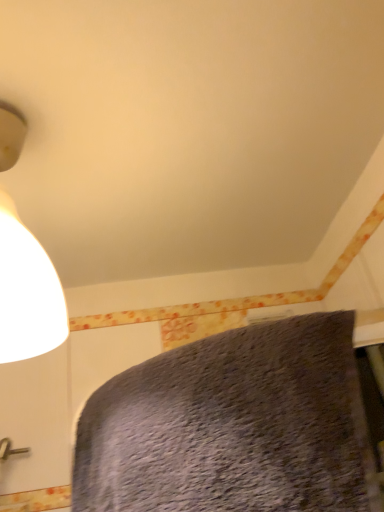
Question: Looking at their shapes, would you say matte white lampshade at upper left is wider or thinner than textured gray bed at lower center?

Choices:
 (A) wide
 (B) thin

Answer: (A)

Question: Is matte white lampshade at upper left to the left or to the right of textured gray bed at lower center in the image?

Choices:
 (A) left
 (B) right

Answer: (A)

Question: In terms of height, does matte white lampshade at upper left look taller or shorter compared to textured gray bed at lower center?

Choices:
 (A) short
 (B) tall

Answer: (B)

Question: Is textured gray bed at lower center wider or thinner than matte white lampshade at upper left?

Choices:
 (A) wide
 (B) thin

Answer: (B)

Question: From a real-world perspective, is textured gray bed at lower center positioned above or below matte white lampshade at upper left?

Choices:
 (A) below
 (B) above

Answer: (A)

Question: Considering their positions, is textured gray bed at lower center located in front of or behind matte white lampshade at upper left?

Choices:
 (A) front
 (B) behind

Answer: (A)

Question: Considering the positions of textured gray bed at lower center and matte white lampshade at upper left in the image, is textured gray bed at lower center bigger or smaller than matte white lampshade at upper left?

Choices:
 (A) small
 (B) big

Answer: (B)